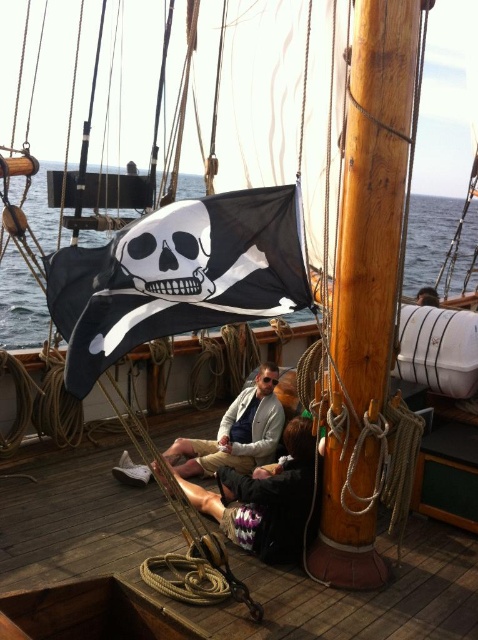
Locate an element on the screen. This screenshot has width=478, height=640. dark brown leather hammock at center is located at coordinates (267, 499).

Is point (283, 554) closer to viewer compared to point (138, 224)?

No, it is behind (138, 224).

Does point (253, 513) come in front of point (130, 272)?

No, (253, 513) is behind (130, 272).

In order to click on dark brown leather hammock at center in this screenshot , I will do `click(267, 499)`.

Between point (248, 548) and point (123, 467), which one is positioned in front?

Point (248, 548)

Is dark brown leather hammock at center taller than khaki cotton pants at center?

No, dark brown leather hammock at center is not taller than khaki cotton pants at center.

What are the coordinates of `dark brown leather hammock at center` in the screenshot? It's located at (267, 499).

Between wooden deck at center and black matte skull at center, which one is positioned higher?

black matte skull at center is higher up.

Can you confirm if wooden deck at center is thinner than black matte skull at center?

No.

Find the location of a particular element. The height and width of the screenshot is (640, 478). wooden deck at center is located at coordinates (229, 563).